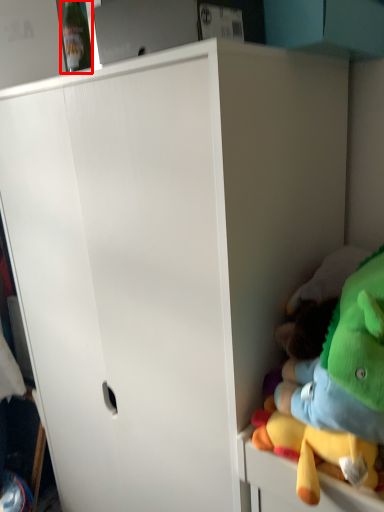
Question: Considering the relative positions of bottle (annotated by the red box) and toy in the image provided, where is bottle (annotated by the red box) located with respect to the staircase?

Choices:
 (A) right
 (B) left

Answer: (B)